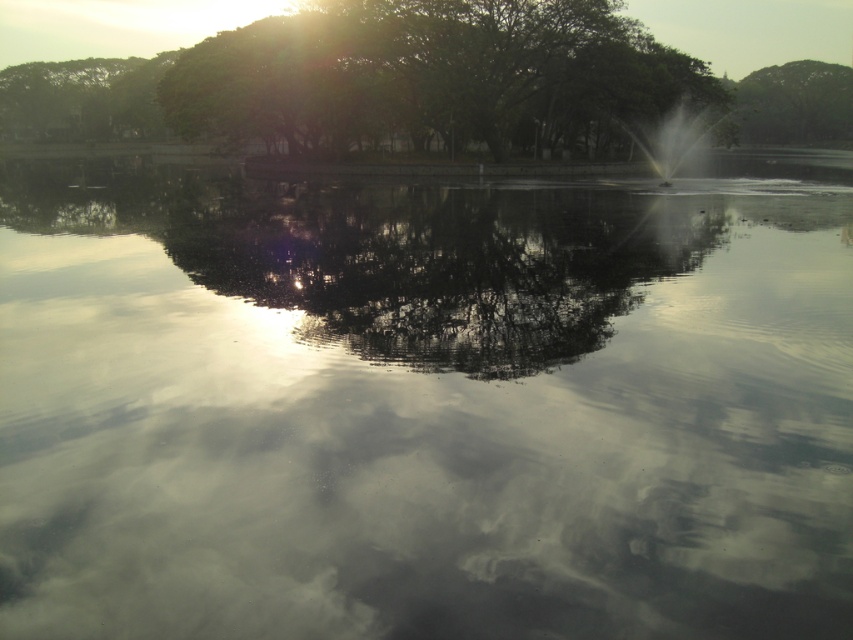
You are an artist trying to paint the scene. You need to decide which object to paint first based on their sizes. Which object should you paint first, the glossy reflective water at center or the green leafy tree at upper right?

The green leafy tree at upper right is larger than the glossy reflective water at center, so you should paint the green leafy tree at upper right first to ensure proper scaling when adding the smaller elements later.

You are standing at the center of the park and see the point marked at coordinates point (434, 262). What is located at that point?

The point (434, 262) is where the glossy reflective water at center is located.

You are standing at the edge of the water and see the point marked as point (434, 262). What does this point represent?

The point (434, 262) represents the glossy reflective water at center.